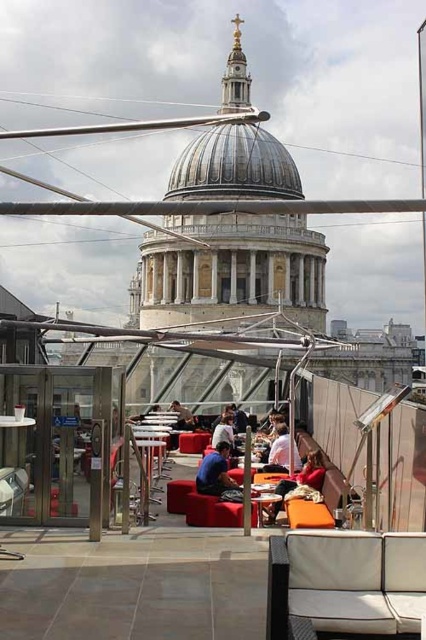
Question: Can you confirm if velvet red cushion at center is positioned to the left of matte black jacket at center?

Choices:
 (A) no
 (B) yes

Answer: (A)

Question: Which object is farther from the camera taking this photo?

Choices:
 (A) metallic silver chair at lower left
 (B) wooden table at center
 (C) matte orange cushion at center
 (D) blue fabric couch at center

Answer: (D)

Question: Which object is the farthest from the velvet red cushion at center?

Choices:
 (A) white fabric shirt at center
 (B) orange fabric chair at lower right
 (C) metallic silver chair at lower left
 (D) matte orange cushion at center

Answer: (C)

Question: In this image, where is white fabric couch at center located relative to matte orange cushion at center?

Choices:
 (A) left
 (B) right

Answer: (B)

Question: Which object is closer to the camera taking this photo?

Choices:
 (A) metallic silver table at center
 (B) metallic silver chair at lower left
 (C) wooden table at center

Answer: (B)

Question: Is white fabric couch at center wider than white fabric shirt at center?

Choices:
 (A) yes
 (B) no

Answer: (A)